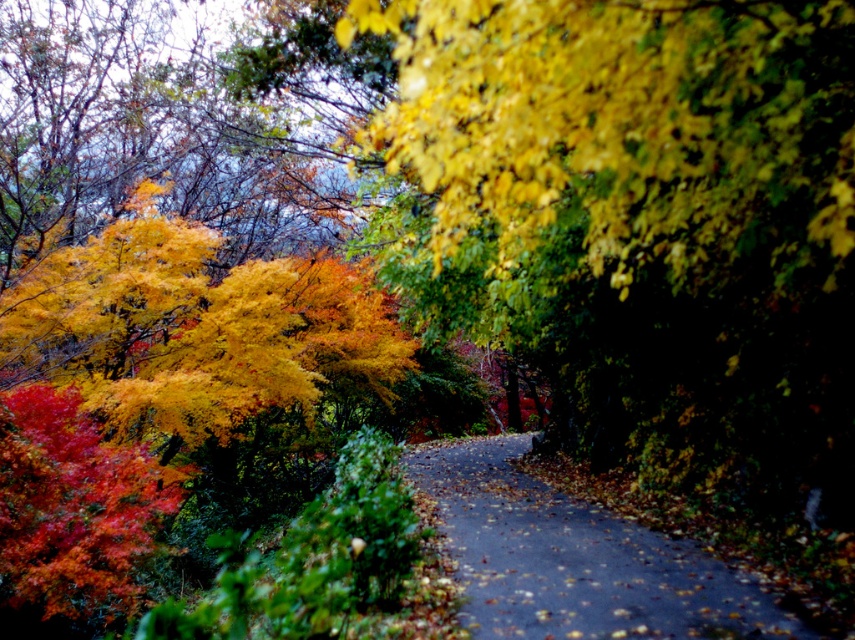
Question: Is vibrant yellow leaves at left above dark asphalt road at center?

Choices:
 (A) yes
 (B) no

Answer: (A)

Question: In this image, where is vibrant yellow leaves at left located relative to dark asphalt road at center?

Choices:
 (A) below
 (B) above

Answer: (B)

Question: Does vibrant yellow leaves at left have a smaller size compared to dark asphalt road at center?

Choices:
 (A) yes
 (B) no

Answer: (B)

Question: Which point is farther from the camera taking this photo?

Choices:
 (A) (27, 276)
 (B) (734, 586)

Answer: (A)

Question: Which point appears closest to the camera in this image?

Choices:
 (A) (472, 627)
 (B) (311, 333)

Answer: (A)

Question: Which of the following is the closest to the observer?

Choices:
 (A) (457, 547)
 (B) (130, 246)

Answer: (A)